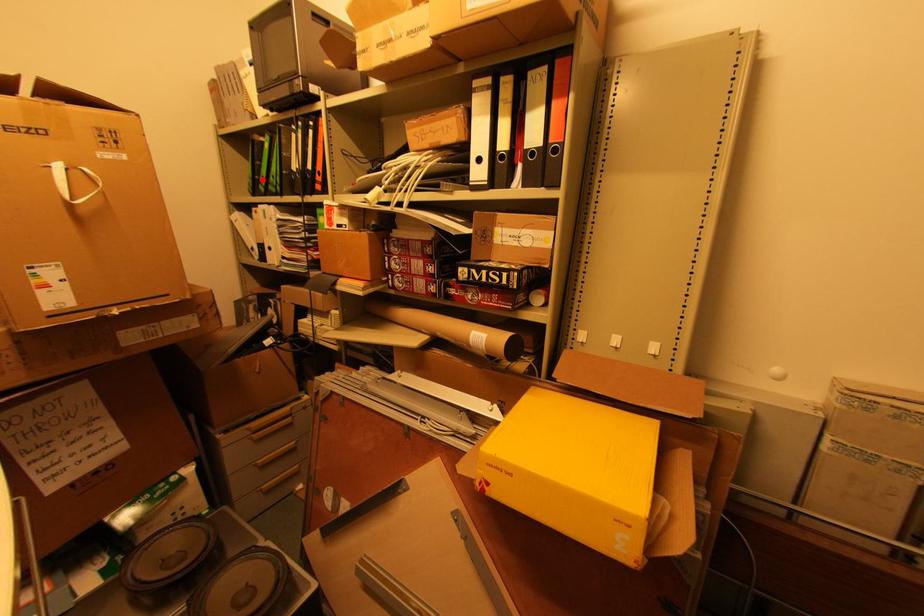
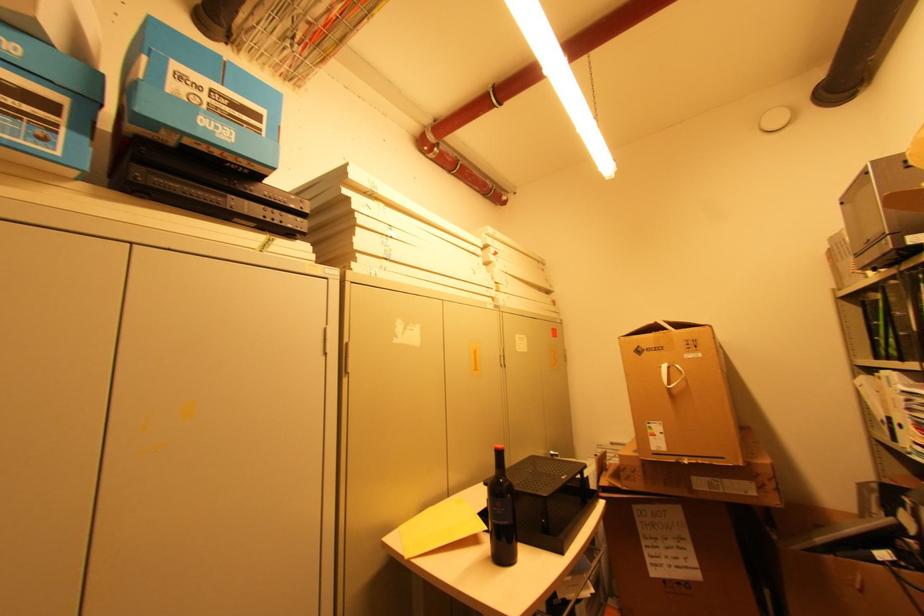
The point at the highlighted location is marked in the first image. Where is the corresponding point in the second image?

(881, 341)